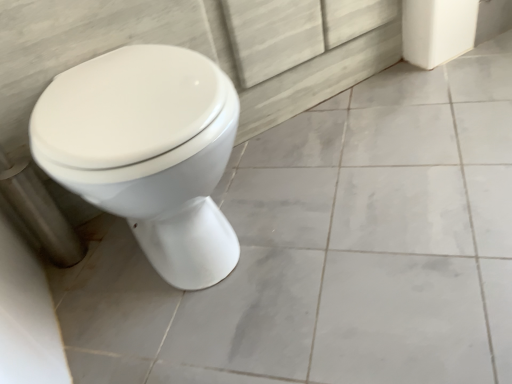
Locate an element on the screen. This screenshot has width=512, height=384. vacant space underneath white glossy toilet at left (from a real-world perspective) is located at coordinates (226, 271).